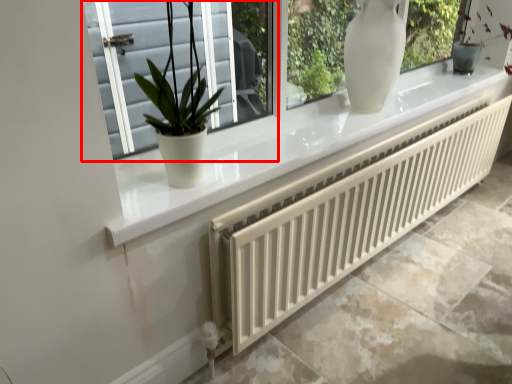
Question: Observing the image, what is the correct spatial positioning of window (annotated by the red box) in reference to radiator?

Choices:
 (A) left
 (B) right

Answer: (A)